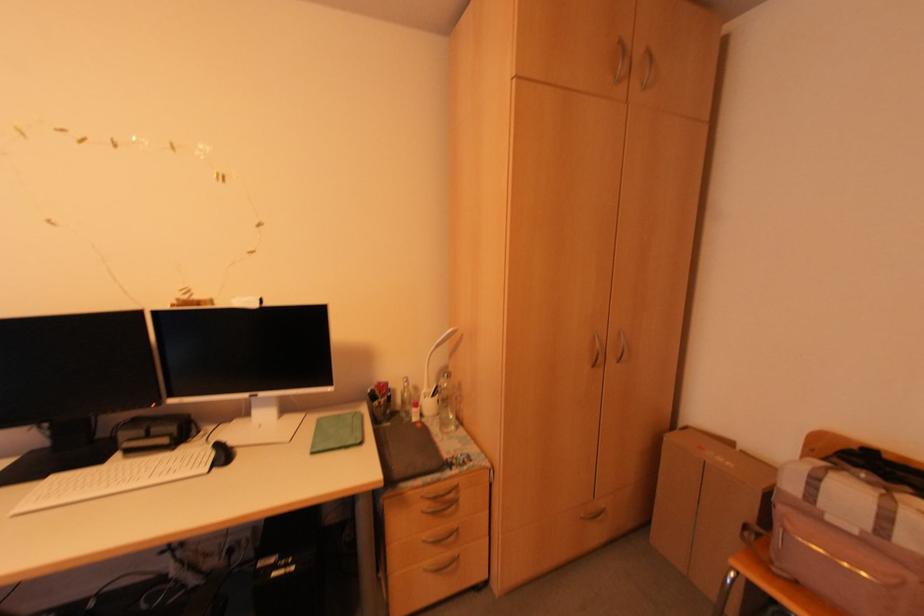
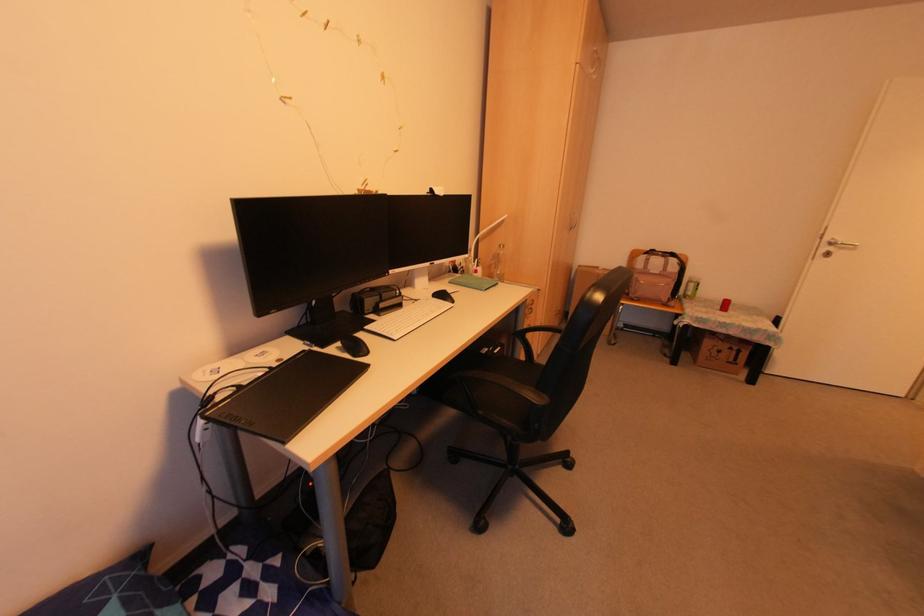
Find the pixel in the second image that matches (854,532) in the first image.

(655, 273)